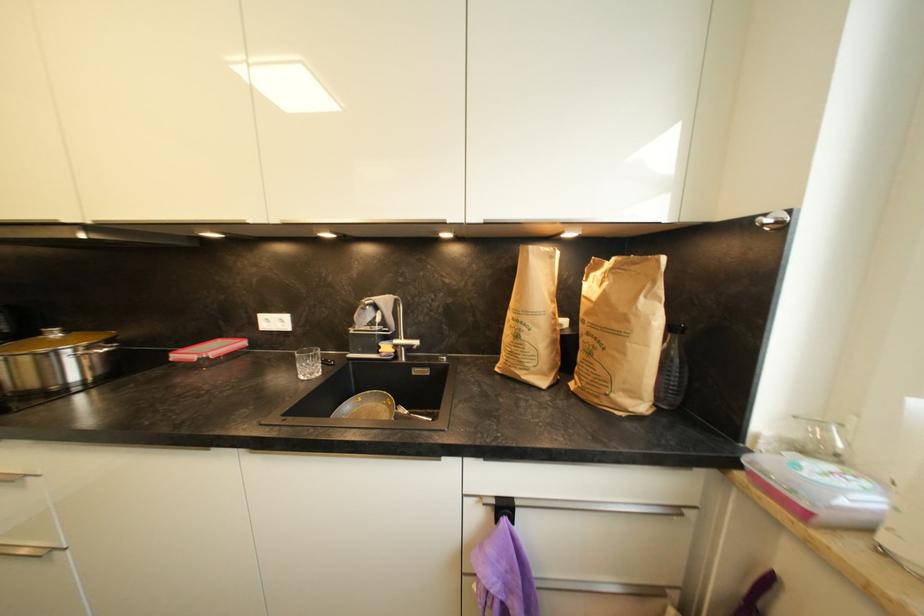
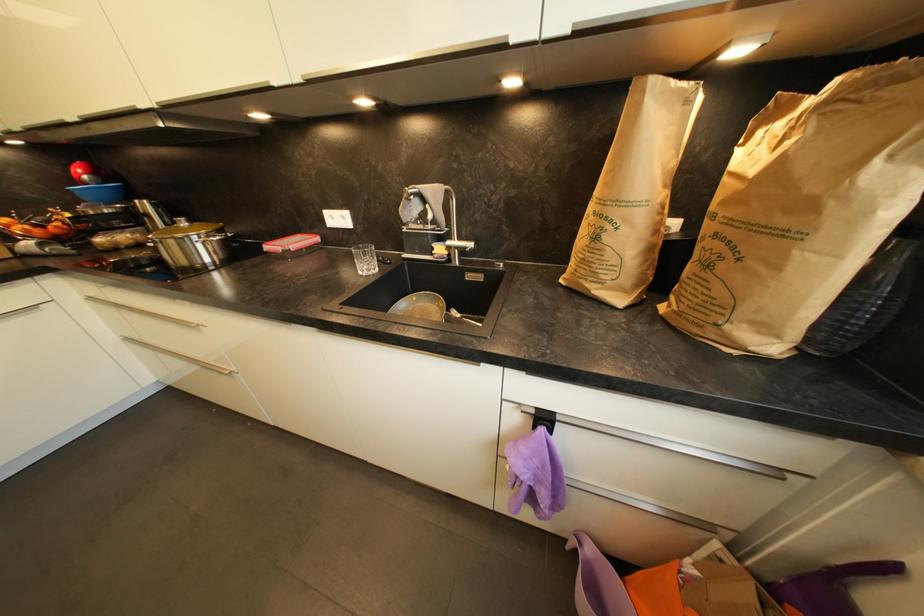
The first image is from the beginning of the video and the second image is from the end. How did the camera likely rotate when shooting the video?

The rotation direction of the camera is left-down.